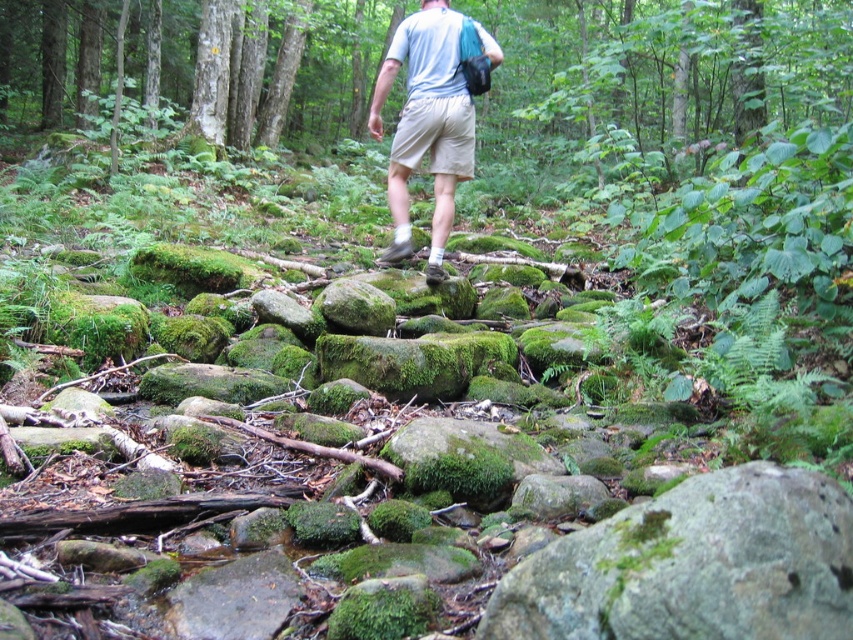
Can you confirm if light beige shorts at center is bigger than beige cotton shorts at center?

Yes.

Is light beige shorts at center to the left of beige cotton shorts at center from the viewer's perspective?

Correct, you'll find light beige shorts at center to the left of beige cotton shorts at center.

Is point (445, 161) closer to camera compared to point (434, 140)?

Yes.

Find the location of `light beige shorts at center`. light beige shorts at center is located at coordinates (426, 124).

Does point (795, 618) come behind point (451, 132)?

No, it is in front of (451, 132).

Which of these two, green mossy rock at center or beige cotton shorts at center, stands shorter?

green mossy rock at center

Describe the element at coordinates (693, 564) in the screenshot. The width and height of the screenshot is (853, 640). I see `green mossy rock at center` at that location.

Where is `green mossy rock at center`? green mossy rock at center is located at coordinates (693, 564).

Is point (688, 538) more distant than point (399, 156)?

No, it is not.

Is green mossy rock at center smaller than light beige shorts at center?

Indeed, green mossy rock at center has a smaller size compared to light beige shorts at center.

Which is in front, point (689, 493) or point (432, 257)?

Positioned in front is point (689, 493).

The image size is (853, 640). Find the location of `green mossy rock at center`. green mossy rock at center is located at coordinates (693, 564).